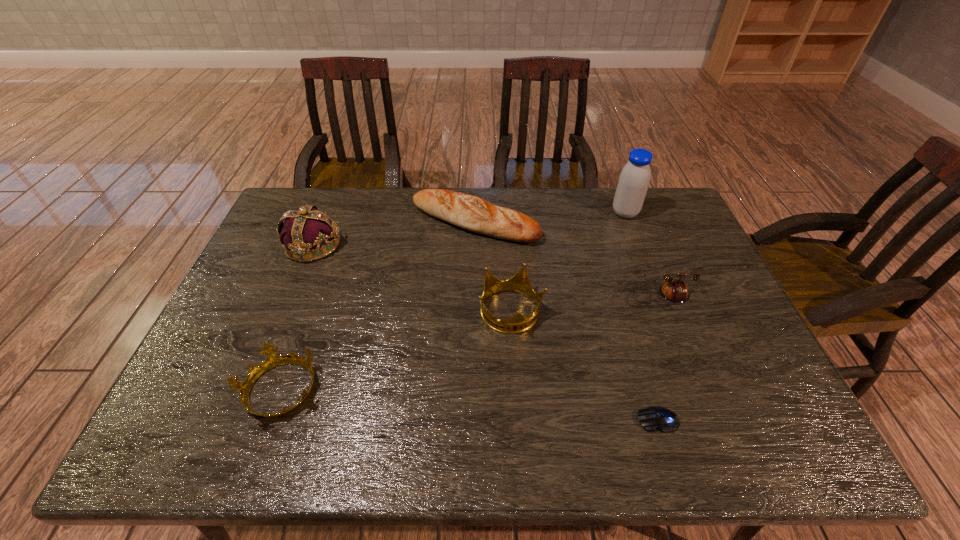
At what (x,y) coordinates should I click in order to perform the action: click on baguet that is at the far edge. Please return your answer as a coordinate pair (x, y). This screenshot has width=960, height=540. Looking at the image, I should click on (469, 212).

I want to click on crown present at the near edge, so coord(273,360).

The width and height of the screenshot is (960, 540). What are the coordinates of `computer mouse positioned at the near edge` in the screenshot? It's located at (654, 417).

The height and width of the screenshot is (540, 960). I want to click on soya milk situated at the right edge, so click(x=634, y=179).

Locate an element on the screen. Image resolution: width=960 pixels, height=540 pixels. telephone that is at the right edge is located at coordinates (x=673, y=290).

Find the location of a particular element. The width and height of the screenshot is (960, 540). object located in the far left corner section of the desktop is located at coordinates (305, 229).

Image resolution: width=960 pixels, height=540 pixels. Identify the location of object that is at the near left corner. (273, 360).

The height and width of the screenshot is (540, 960). I want to click on object located in the far right corner section of the desktop, so click(634, 179).

Where is `free space at the far edge of the desktop`? free space at the far edge of the desktop is located at coordinates (582, 227).

In the image, there is a desktop. Where is `free space at the near edge`? The width and height of the screenshot is (960, 540). free space at the near edge is located at coordinates (618, 454).